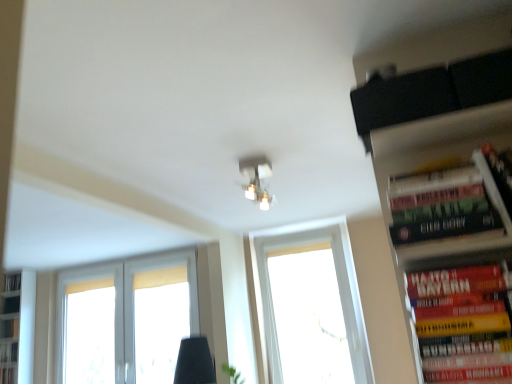
Question: Considering the relative sizes of transparent glass window at center, the first window when ordered from right to left, and hardcover book at right, the 2th book positioned from the right, in the image provided, is transparent glass window at center, the first window when ordered from right to left, smaller than hardcover book at right, the 2th book positioned from the right,?

Choices:
 (A) no
 (B) yes

Answer: (A)

Question: Can you confirm if transparent glass window at center, the first window when ordered from right to left, is wider than hardcover book at right, the 2th book positioned from the right?

Choices:
 (A) yes
 (B) no

Answer: (A)

Question: Considering the relative positions of transparent glass window at center, the first window when ordered from right to left, and hardcover book at right, the 2th book positioned from the right, in the image provided, is transparent glass window at center, the first window when ordered from right to left, to the left of hardcover book at right, the 2th book positioned from the right, from the viewer's perspective?

Choices:
 (A) no
 (B) yes

Answer: (B)

Question: From the image's perspective, is transparent glass window at center, the first window when ordered from right to left, below hardcover book at right, acting as the second book starting from the front?

Choices:
 (A) yes
 (B) no

Answer: (A)

Question: Is transparent glass window at center, the second window in the left-to-right sequence, aimed at hardcover book at right, positioned as the 2th book in left-to-right order?

Choices:
 (A) yes
 (B) no

Answer: (A)

Question: Does point (496, 380) appear closer or farther from the camera than point (404, 200)?

Choices:
 (A) closer
 (B) farther

Answer: (A)

Question: Is hardcover book at right, arranged as the first book when viewed from the front, bigger or smaller than hardcover book at right, arranged as the 1th book when viewed from the top?

Choices:
 (A) small
 (B) big

Answer: (A)

Question: From the image's perspective, is hardcover book at right, which ranks as the third book in back-to-front order, positioned above or below hardcover book at right, arranged as the second book when viewed from the back?

Choices:
 (A) below
 (B) above

Answer: (A)

Question: Considering their positions, is hardcover book at right, which ranks as the second book in top-to-bottom order, located in front of or behind hardcover book at right, arranged as the second book when viewed from the back?

Choices:
 (A) behind
 (B) front

Answer: (B)

Question: Visually, is white matte window at lower left, arranged as the 1th window when viewed from the left, positioned to the left or to the right of hardcover book at right, the 3th book when ordered from left to right?

Choices:
 (A) left
 (B) right

Answer: (A)

Question: In terms of size, does white matte window at lower left, positioned as the second window in right-to-left order, appear bigger or smaller than hardcover book at right, arranged as the first book when viewed from the front?

Choices:
 (A) big
 (B) small

Answer: (A)

Question: From a real-world perspective, relative to hardcover book at right, which is the second book in bottom-to-top order, is white matte window at lower left, arranged as the 1th window when viewed from the left, vertically above or below?

Choices:
 (A) above
 (B) below

Answer: (A)

Question: Relative to hardcover book at right, which is the second book in bottom-to-top order, is white matte window at lower left, positioned as the second window in right-to-left order, in front or behind?

Choices:
 (A) behind
 (B) front

Answer: (A)

Question: In terms of size, does hardcover book at right, positioned as the 2th book in left-to-right order, appear bigger or smaller than hardcover book at right, the 3th book when ordered from left to right?

Choices:
 (A) small
 (B) big

Answer: (B)

Question: From a real-world perspective, is hardcover book at right, positioned as the 2th book in left-to-right order, positioned above or below hardcover book at right, arranged as the first book when viewed from the front?

Choices:
 (A) below
 (B) above

Answer: (B)